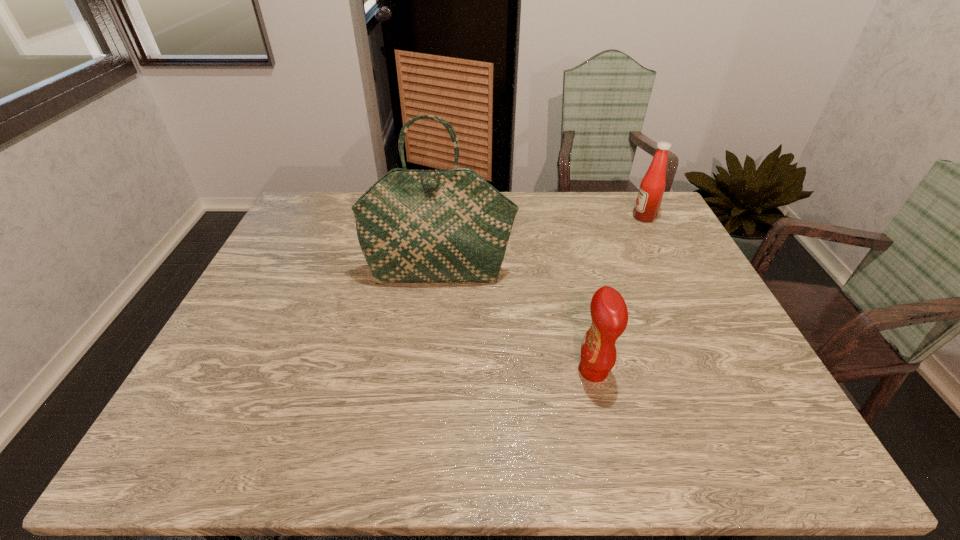
At what (x,y) coordinates should I click in order to perform the action: click on vacant point located 0.400m on the label side of the second object from left to right. Please return your answer as a coordinate pair (x, y). The width and height of the screenshot is (960, 540). Looking at the image, I should click on (405, 371).

Find the location of `blank space located on the label side of the second object from left to right`. blank space located on the label side of the second object from left to right is located at coordinates (513, 371).

This screenshot has width=960, height=540. I want to click on vacant space positioned 0.140m on the label side of the second object from left to right, so click(517, 371).

The image size is (960, 540). Identify the location of object located at the far edge. (648, 201).

The width and height of the screenshot is (960, 540). Identify the location of object that is at the right edge. (648, 201).

Locate an element on the screen. The width and height of the screenshot is (960, 540). object present at the far right corner is located at coordinates (648, 201).

This screenshot has height=540, width=960. In order to click on vacant point at the far edge in this screenshot , I will do `click(596, 197)`.

Where is `vacant space at the near edge of the desktop`? The width and height of the screenshot is (960, 540). vacant space at the near edge of the desktop is located at coordinates (613, 451).

You are a GUI agent. You are given a task and a screenshot of the screen. Output one action in this format:
    pyautogui.click(x=<x>, y=<y>)
    Task: Click on the free space at the left edge of the desktop
    This screenshot has width=960, height=540.
    Given the screenshot: What is the action you would take?
    pyautogui.click(x=307, y=281)

This screenshot has height=540, width=960. What are the coordinates of `vacant space at the right edge` in the screenshot? It's located at (666, 292).